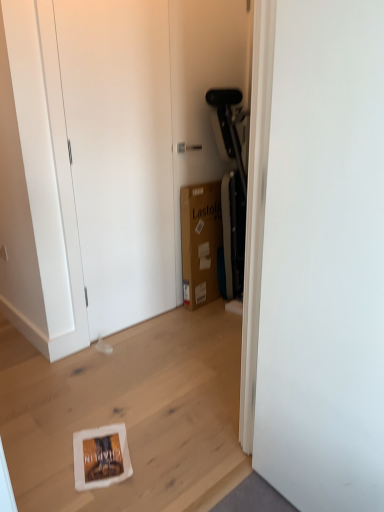
I want to click on vacant region in front of white matte door at upper left, the 1th door when ordered from back to front, so click(119, 357).